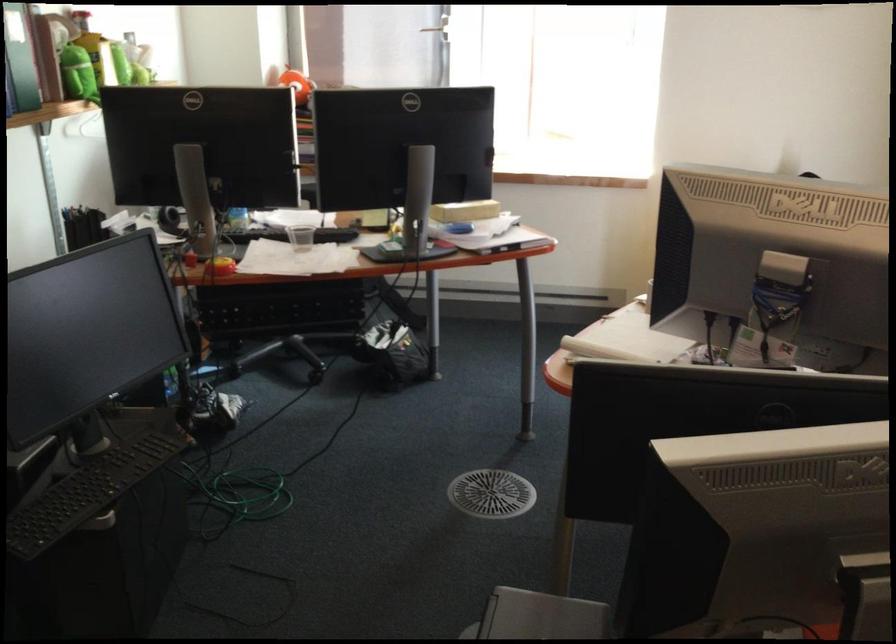
Where would you lift the black keyboard? Please return your answer as a coordinate pair (x, y).

(88, 491)